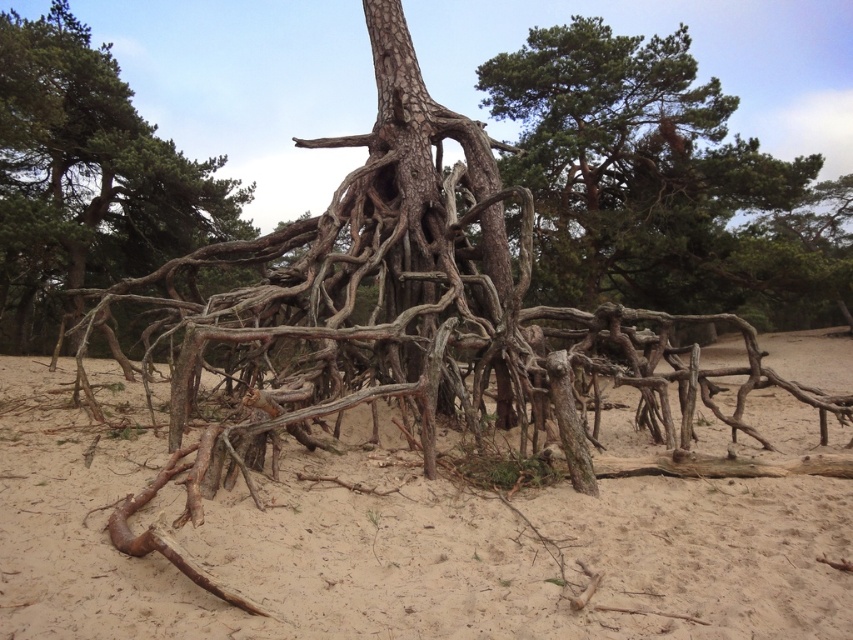
Question: Among these points, which one is nearest to the camera?

Choices:
 (A) (123, 83)
 (B) (689, 70)
 (C) (45, 384)

Answer: (C)

Question: Can you confirm if brown wood roots at center is smaller than green textured pine tree at upper center?

Choices:
 (A) no
 (B) yes

Answer: (B)

Question: Is brown wood roots at center to the left of green textured pine tree at upper center from the viewer's perspective?

Choices:
 (A) no
 (B) yes

Answer: (B)

Question: Which of the following is the closest to the observer?

Choices:
 (A) click(672, 76)
 (B) click(62, 509)
 (C) click(189, 248)

Answer: (B)

Question: Can you confirm if brown wood roots at center is thinner than green textured pine tree at upper center?

Choices:
 (A) yes
 (B) no

Answer: (A)

Question: Among these points, which one is farthest from the camera?

Choices:
 (A) (387, 593)
 (B) (109, 253)
 (C) (575, 52)

Answer: (B)